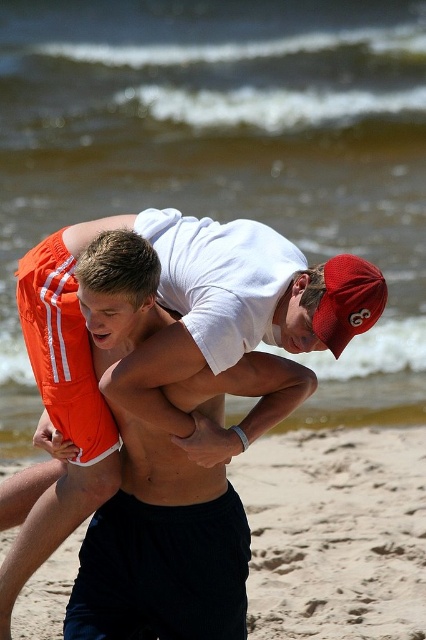
Question: Which point is closer to the camera?

Choices:
 (A) (359, 586)
 (B) (377, 316)
 (C) (69, 384)
 (D) (89, 362)

Answer: (B)

Question: Which object is the farthest from the red mesh baseball cap at upper right?

Choices:
 (A) orange fabric shorts at center
 (B) sandy beach at lower center
 (C) orange fabric life jacket at left

Answer: (B)

Question: Is orange fabric life jacket at left thinner than red mesh baseball cap at upper right?

Choices:
 (A) no
 (B) yes

Answer: (A)

Question: Is sandy beach at lower center to the right of orange fabric life jacket at left from the viewer's perspective?

Choices:
 (A) yes
 (B) no

Answer: (A)

Question: Is sandy beach at lower center bigger than orange fabric life jacket at left?

Choices:
 (A) no
 (B) yes

Answer: (B)

Question: Which point is closer to the camera?

Choices:
 (A) (x=339, y=340)
 (B) (x=330, y=544)

Answer: (A)